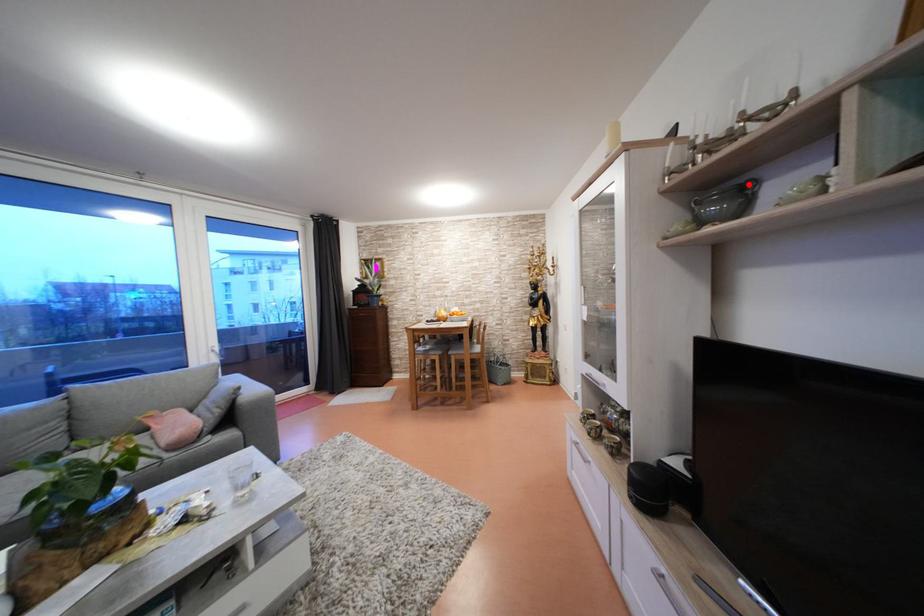
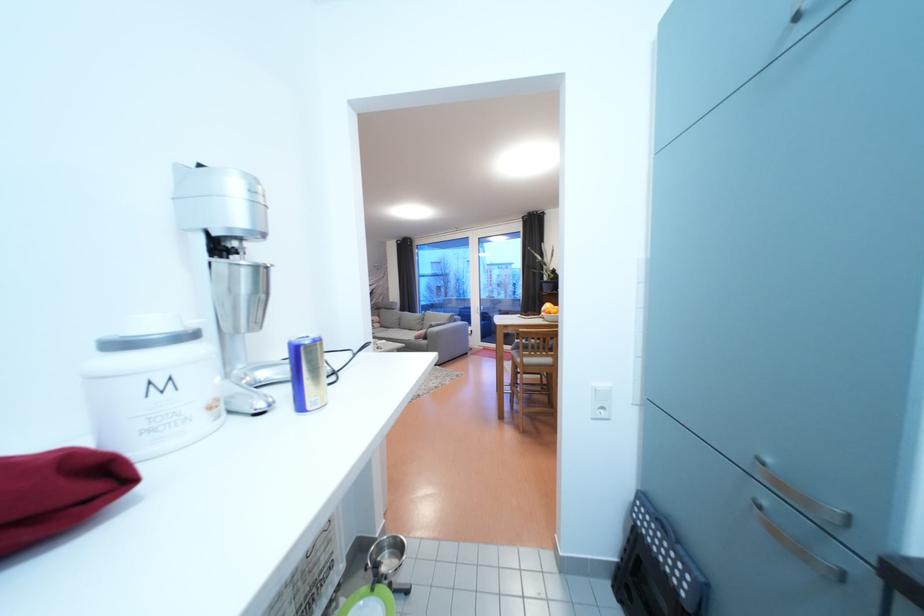
Question: I am providing you with two images of the same scene from different viewpoints. A red point is marked on the first image. Can you still see the location of the red point in image 2?

Choices:
 (A) Yes
 (B) No

Answer: (B)